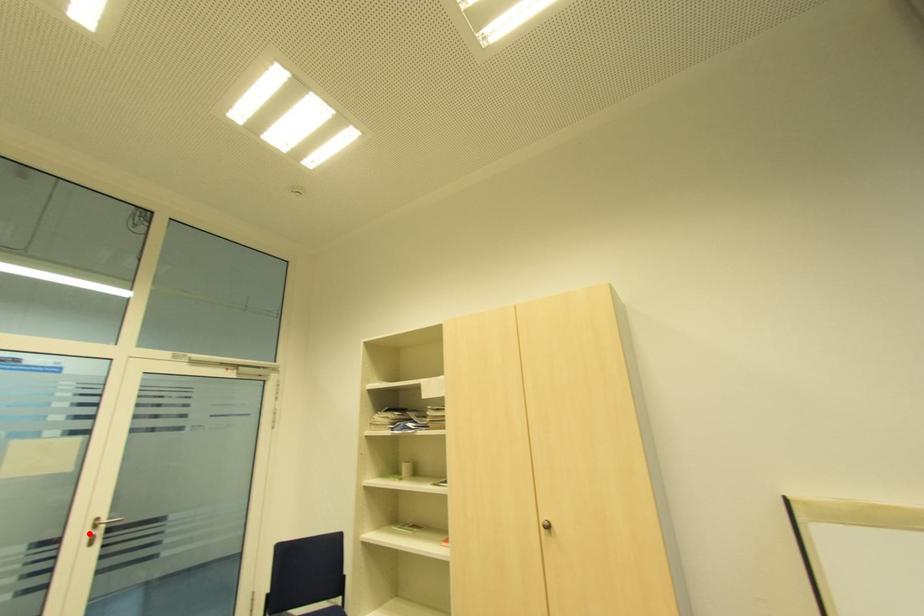
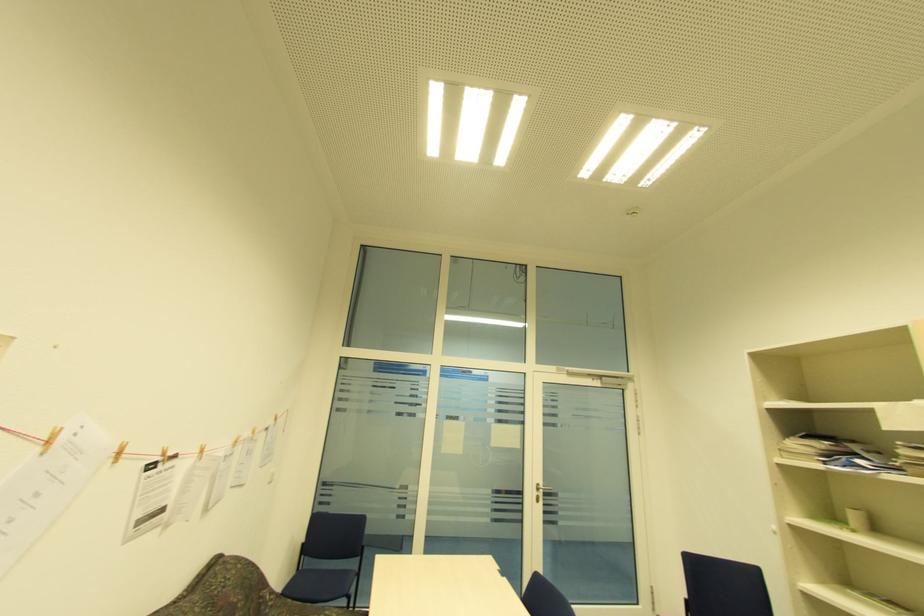
Locate, in the second image, the point that corresponds to the highlighted location in the first image.

(538, 493)